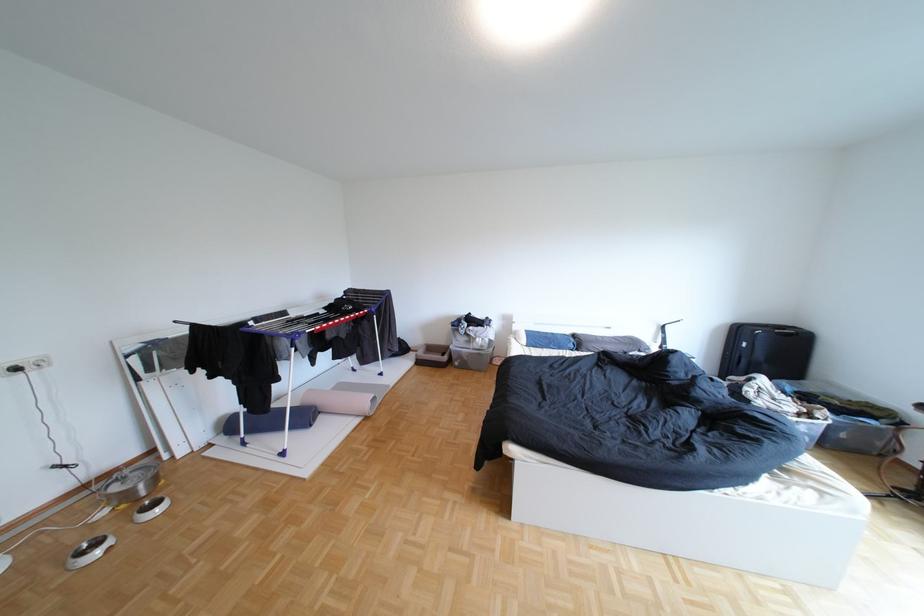
Find where to lift the pink rolled mat. Please return your answer as a coordinate pair (x, y).

(341, 400)